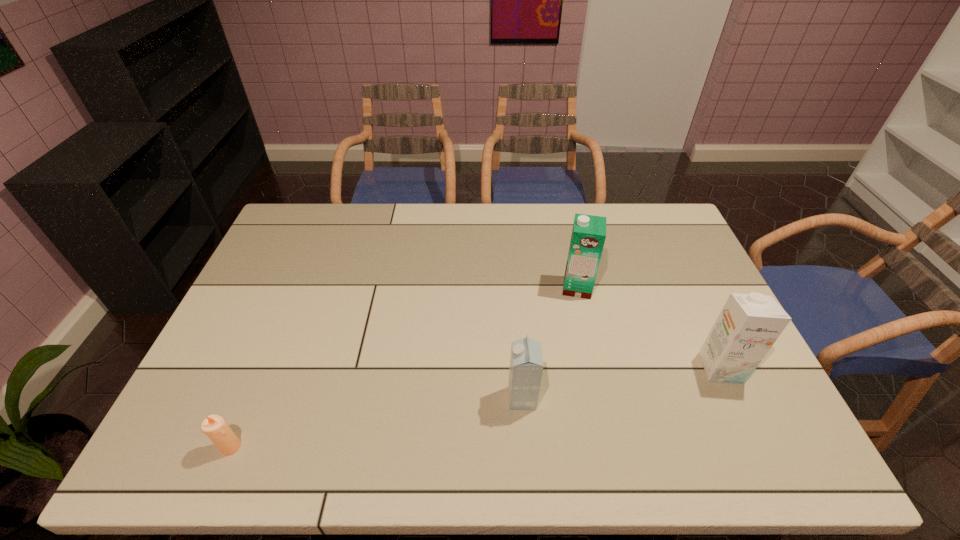
Where is `vacant region between the nearest object and the third object from left to right`? The width and height of the screenshot is (960, 540). vacant region between the nearest object and the third object from left to right is located at coordinates (404, 367).

I want to click on unoccupied position between the second nearest carton and the leftmost carton, so click(x=621, y=383).

Locate an element on the screen. vacant space that is in between the third nearest object and the farthest object is located at coordinates (649, 328).

You are a GUI agent. You are given a task and a screenshot of the screen. Output one action in this format:
    pyautogui.click(x=<x>, y=<y>)
    Task: Click on the free spot between the farthest carton and the shortest object
    Image resolution: width=960 pixels, height=540 pixels.
    Given the screenshot: What is the action you would take?
    pyautogui.click(x=404, y=367)

At what (x,y) coordinates should I click in order to perform the action: click on object that is the second closest to the shortest object. Please return your answer as a coordinate pair (x, y). Looking at the image, I should click on (588, 236).

Identify which object is the nearest to the rightmost carton. Please provide its 2D coordinates. Your answer should be formatted as a tuple, i.e. [(x, y)], where the tuple contains the x and y coordinates of a point satisfying the conditions above.

[(588, 236)]

Identify the location of carton that is the closest to the nearest object. The width and height of the screenshot is (960, 540). pos(526,362).

The image size is (960, 540). I want to click on carton that is the second closest to the nearest object, so click(588, 236).

You are a GUI agent. You are given a task and a screenshot of the screen. Output one action in this format:
    pyautogui.click(x=<x>, y=<y>)
    Task: Click on the free region that satisfies the following two spatial constraints: 1. on the front side of the farthest carton; 2. on the front label of the nearest carton
    
    Given the screenshot: What is the action you would take?
    (x=602, y=398)

Where is `vacant space that satisfies the following two spatial constraints: 1. on the front side of the second farthest carton; 2. on the left side of the second carton from right to left`? vacant space that satisfies the following two spatial constraints: 1. on the front side of the second farthest carton; 2. on the left side of the second carton from right to left is located at coordinates (595, 368).